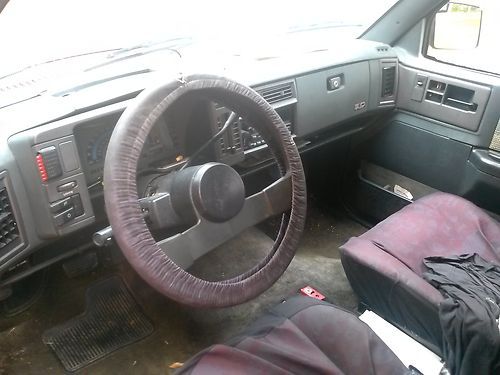
In order to click on seat in this screenshot , I will do `click(277, 353)`, `click(426, 241)`.